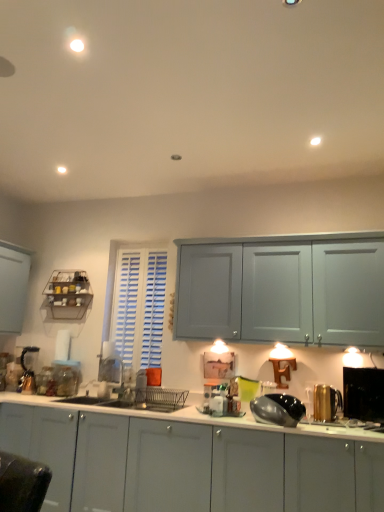
Question: Would you say black glossy toaster at right, positioned as the 2th appliance in front-to-back order, is to the left or to the right of clear glass jar at lower left, which is counted as the 4th appliance, starting from the right, in the picture?

Choices:
 (A) left
 (B) right

Answer: (B)

Question: Is black glossy toaster at right, which is counted as the fifth appliance, starting from the left, in front of or behind clear glass jar at lower left, marked as the second appliance in a left-to-right arrangement, in the image?

Choices:
 (A) front
 (B) behind

Answer: (A)

Question: Estimate the real-world distances between objects in this image. Which object is farther from the shiny metallic kettle at center, the 3th appliance in the left-to-right sequence?

Choices:
 (A) clear glass jar at lower left, marked as the second appliance in a left-to-right arrangement
 (B) gold metallic kettle at right, which ranks as the 2th appliance in right-to-left order
 (C) white glossy cabinets at lower center
 (D) metallic silver blender at left, which is the fifth appliance in front-to-back order
 (E) metallic wire rack at left

Answer: (D)

Question: Which of these objects is positioned farthest from the metallic silver blender at left, which is the fifth appliance in front-to-back order?

Choices:
 (A) metallic wire rack at left
 (B) black glossy toaster at right, positioned as the 2th appliance in front-to-back order
 (C) shiny metallic kettle at center, the 3th appliance in the left-to-right sequence
 (D) white glossy cabinets at lower center
 (E) gold metallic kettle at right, which ranks as the 2th appliance in right-to-left order

Answer: (B)